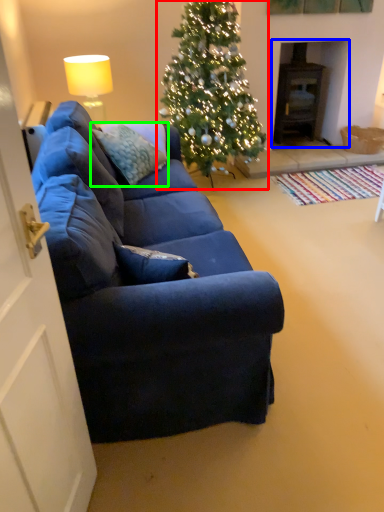
Question: Based on their relative distances, which object is farther from christmas tree (highlighted by a red box)? Choose from fireplace (highlighted by a blue box) and pillow (highlighted by a green box).

Choices:
 (A) fireplace
 (B) pillow

Answer: (A)